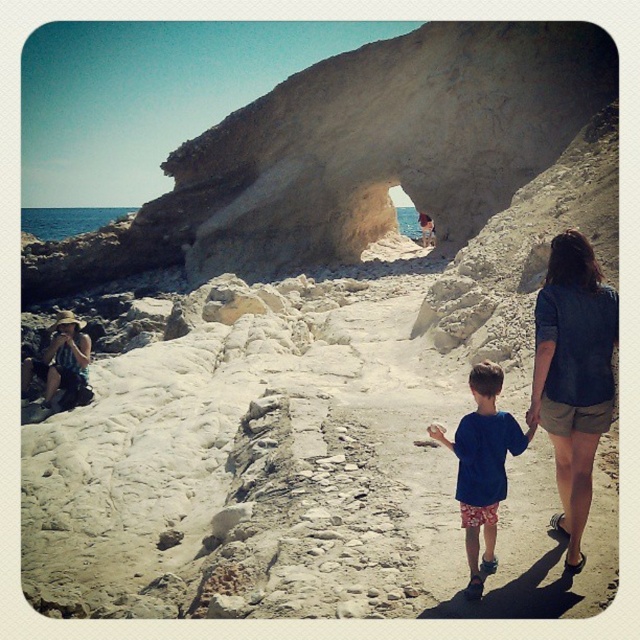
Is beige stone arch at center to the left of denim shorts at right from the viewer's perspective?

Incorrect, beige stone arch at center is not on the left side of denim shorts at right.

Does beige stone arch at center lie behind denim shorts at right?

Yes, it is behind denim shorts at right.

Who is more distant from viewer, (531, 84) or (604, 284)?

The point (531, 84) is behind.

Where is `beige stone arch at center`? beige stone arch at center is located at coordinates (384, 144).

How distant is beige stone arch at center from blue cotton shirt at center?

The distance of beige stone arch at center from blue cotton shirt at center is 56.94 meters.

Can you confirm if beige stone arch at center is positioned above blue cotton shirt at center?

Yes, beige stone arch at center is above blue cotton shirt at center.

Between point (156, 228) and point (483, 448), which one is positioned behind?

Point (156, 228)

Locate an element on the screen. The image size is (640, 640). beige stone arch at center is located at coordinates (384, 144).

Can you confirm if denim shorts at right is positioned to the left of blue cotton shirt at center?

In fact, denim shorts at right is to the right of blue cotton shirt at center.

Who is higher up, denim shorts at right or blue cotton shirt at center?

Positioned higher is denim shorts at right.

Which is behind, point (602, 316) or point (465, 435)?

The point (602, 316) is more distant.

Find the location of `denim shorts at right`. denim shorts at right is located at coordinates (573, 376).